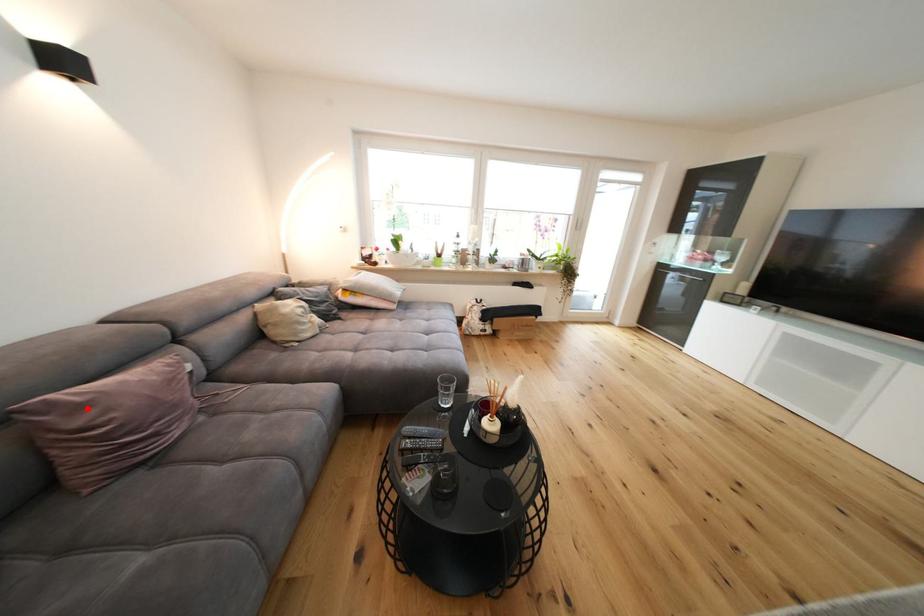
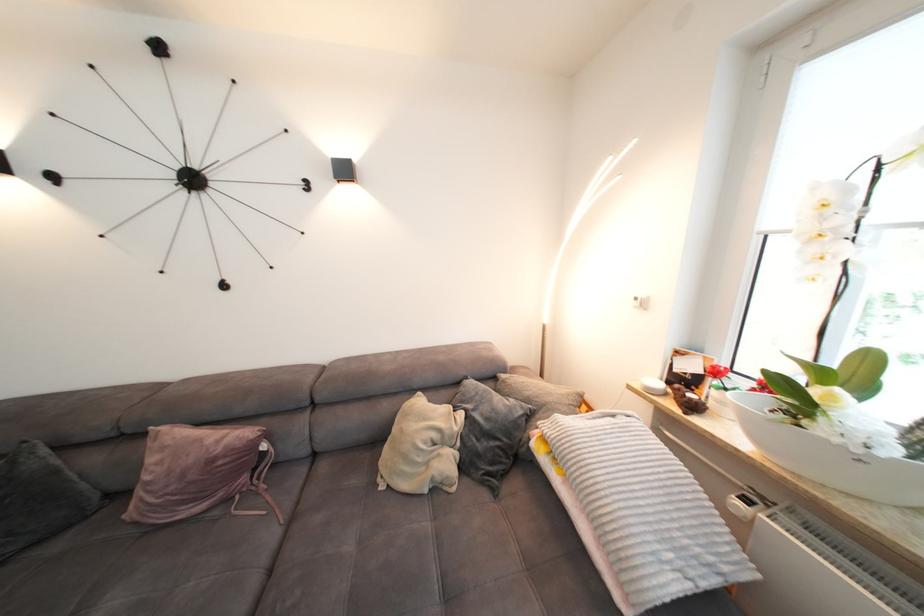
Find the pixel in the second image that matches the highlighted location in the first image.

(171, 448)